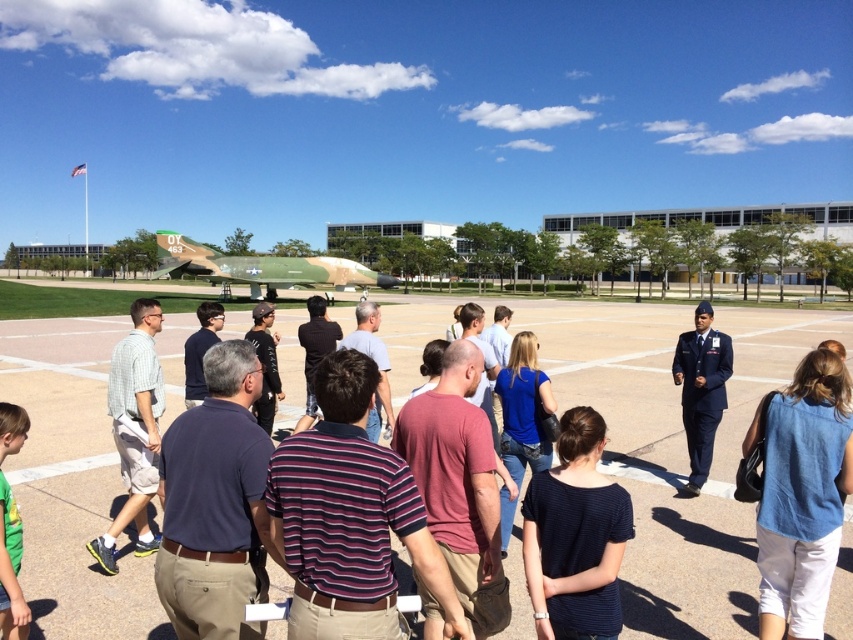
Question: Estimate the real-world distances between objects in this image. Which object is farther from the blue cotton shirt at lower right?

Choices:
 (A) concrete tarmac at center
 (B) dark blue striped shirt at center
 (C) navy blue uniform at center
 (D) camouflage paint airplane at center

Answer: (D)

Question: Which point is farther to the camera?

Choices:
 (A) green t-shirt at lower left
 (B) dark blue shirt at center
 (C) dark blue striped shirt at center
 (D) concrete tarmac at center

Answer: (B)

Question: Which point is farther to the camera?

Choices:
 (A) (306, 300)
 (B) (308, 266)
 (C) (544, 554)

Answer: (A)

Question: Is dark blue striped shirt at center above dark blue shirt at center?

Choices:
 (A) no
 (B) yes

Answer: (A)

Question: Can you confirm if concrete tarmac at center is positioned to the left of blue cotton shirt at lower right?

Choices:
 (A) no
 (B) yes

Answer: (B)

Question: Does dark blue striped shirt at center appear over green t-shirt at lower left?

Choices:
 (A) no
 (B) yes

Answer: (B)